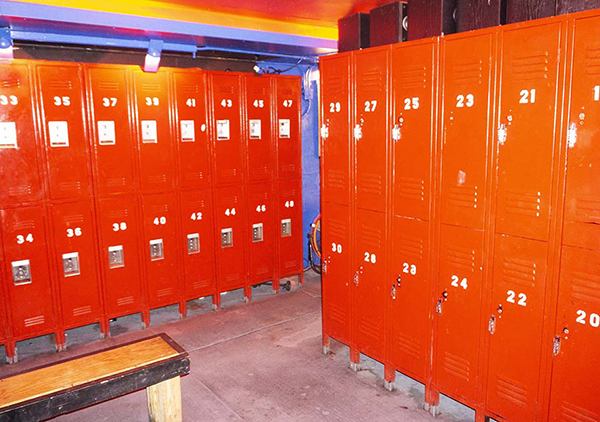
This screenshot has width=600, height=422. I want to click on blue wall behind lockers, so click(283, 42).